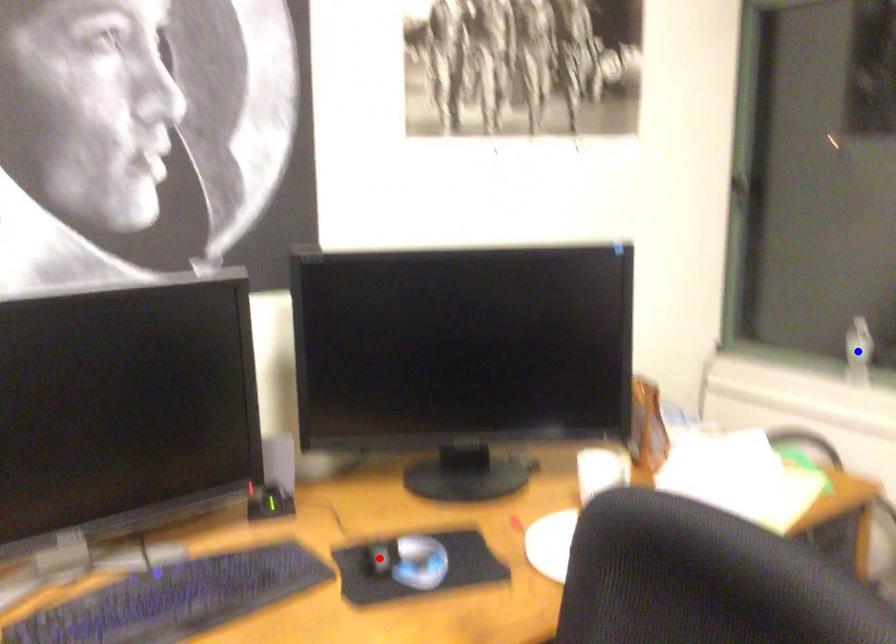
Question: Which of the two points in the image is closer to the camera?

Choices:
 (A) Blue point is closer.
 (B) Red point is closer.

Answer: (B)